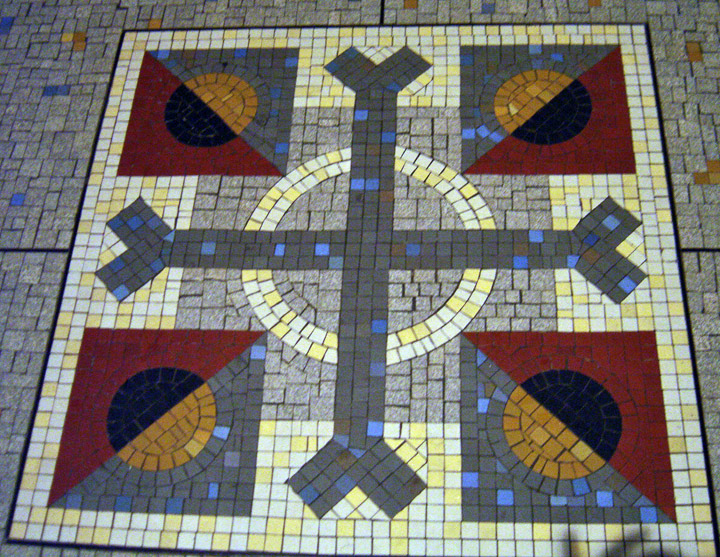
Identify the location of black, red, gold, and blue tiles in square. The image size is (720, 557). (582, 432).